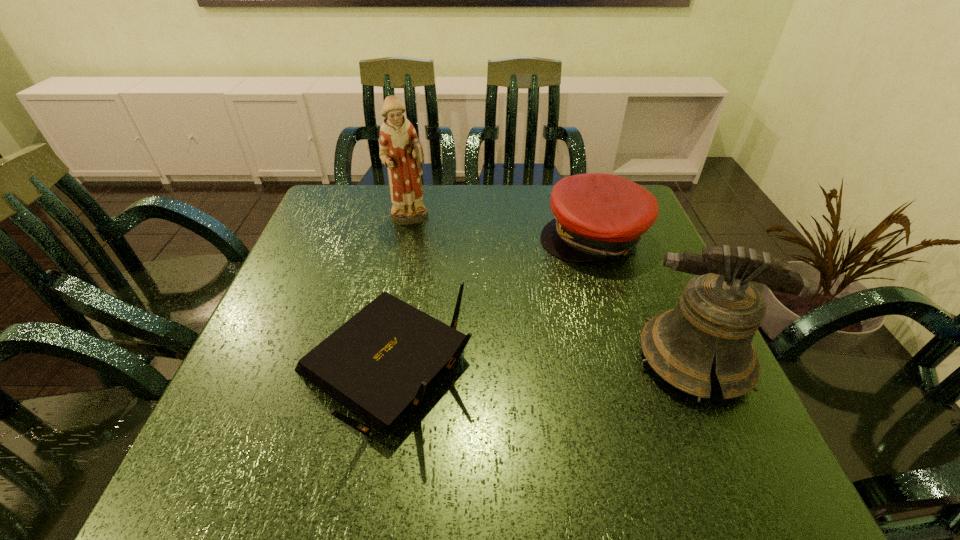
Where is `free point that satisfies the following two spatial constraints: 1. on the front side of the cap; 2. on the right side of the bell`? The height and width of the screenshot is (540, 960). free point that satisfies the following two spatial constraints: 1. on the front side of the cap; 2. on the right side of the bell is located at coordinates (632, 359).